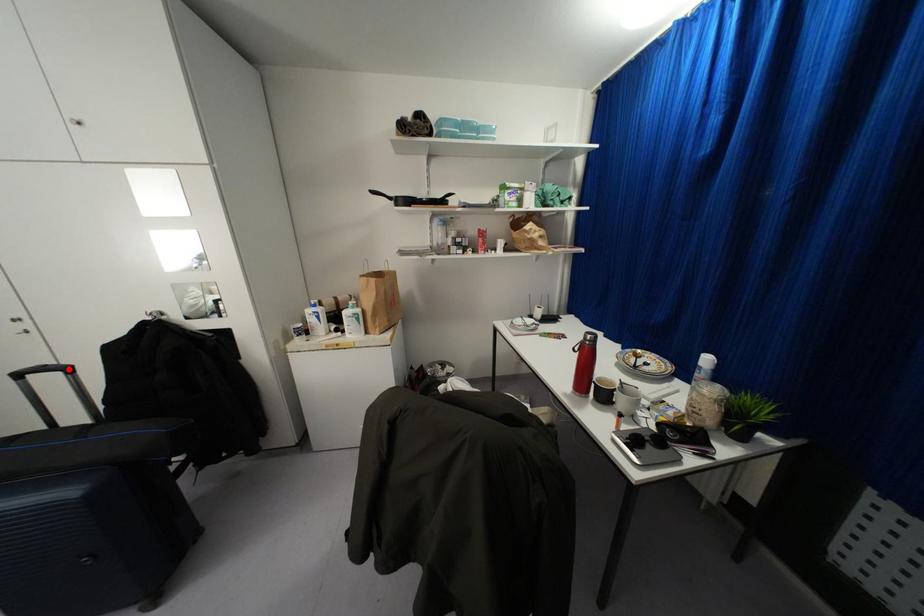
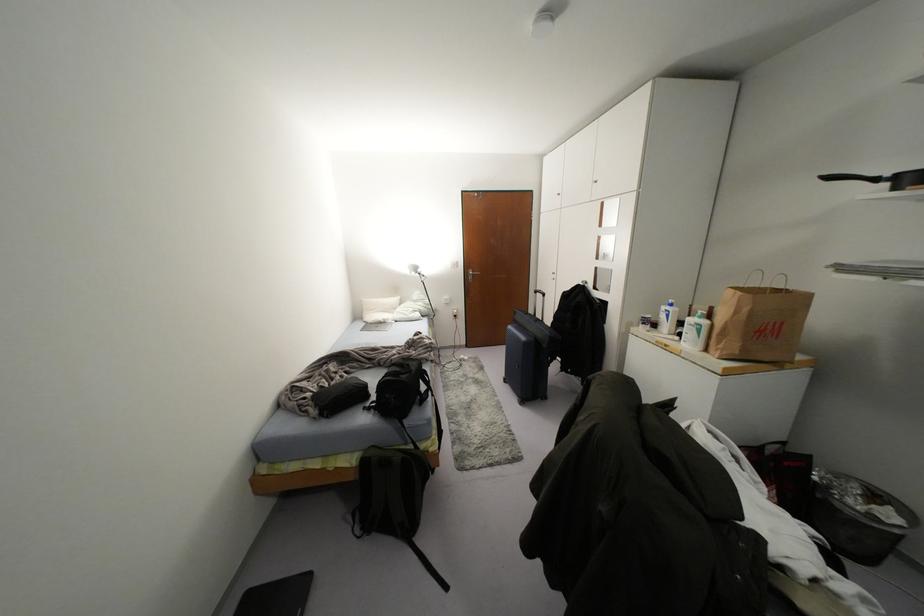
Find the pixel in the second image that matches the highlighted location in the first image.

(542, 294)